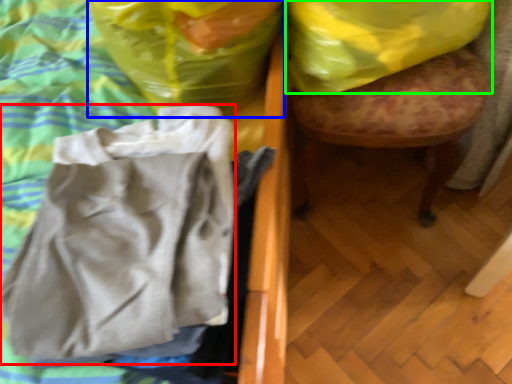
Question: Which is nearer to the wrap (highlighted by a red box)? plastic bag (highlighted by a blue box) or plastic bag (highlighted by a green box).

Choices:
 (A) plastic bag
 (B) plastic bag

Answer: (A)